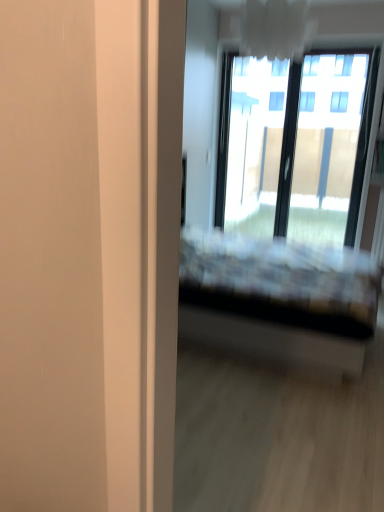
The height and width of the screenshot is (512, 384). What do you see at coordinates (278, 298) in the screenshot? I see `plaid fabric bed at center` at bounding box center [278, 298].

The image size is (384, 512). I want to click on plaid fabric bed at center, so (x=278, y=298).

The height and width of the screenshot is (512, 384). What do you see at coordinates (295, 145) in the screenshot?
I see `transparent glass window at upper right` at bounding box center [295, 145].

At what (x,y) coordinates should I click in order to perform the action: click on transparent glass window at upper right. Please return your answer as a coordinate pair (x, y). This screenshot has height=512, width=384. Looking at the image, I should click on (295, 145).

Find the location of a particular element. This screenshot has height=512, width=384. plaid fabric bed at center is located at coordinates (278, 298).

Is plaid fabric bed at center to the left of transparent glass window at upper right from the viewer's perspective?

Correct, you'll find plaid fabric bed at center to the left of transparent glass window at upper right.

Is plaid fabric bed at center further to the viewer compared to transparent glass window at upper right?

No, plaid fabric bed at center is in front of transparent glass window at upper right.

Which point is more forward, (x=284, y=250) or (x=257, y=199)?

The point (x=284, y=250) is closer.

From the image's perspective, does plaid fabric bed at center appear lower than transparent glass window at upper right?

Yes.

From a real-world perspective, between plaid fabric bed at center and transparent glass window at upper right, who is vertically lower?

plaid fabric bed at center is physically lower.

Considering the relative sizes of plaid fabric bed at center and transparent glass window at upper right in the image provided, is plaid fabric bed at center thinner than transparent glass window at upper right?

In fact, plaid fabric bed at center might be wider than transparent glass window at upper right.

Between plaid fabric bed at center and transparent glass window at upper right, which one has less height?

plaid fabric bed at center is shorter.

In terms of size, does plaid fabric bed at center appear bigger or smaller than transparent glass window at upper right?

Clearly, plaid fabric bed at center is larger in size than transparent glass window at upper right.

Is transparent glass window at upper right a part of plaid fabric bed at center?

That's incorrect, transparent glass window at upper right is not inside plaid fabric bed at center.

Is there a large distance between plaid fabric bed at center and transparent glass window at upper right?

Yes, plaid fabric bed at center is far from transparent glass window at upper right.

From the picture: Could you tell me if plaid fabric bed at center is facing transparent glass window at upper right?

No.

From the picture: What's the angular difference between plaid fabric bed at center and transparent glass window at upper right's facing directions?

plaid fabric bed at center and transparent glass window at upper right are facing 91 degrees away from each other.

The height and width of the screenshot is (512, 384). Find the location of `bed that appears in front of the transparent glass window at upper right`. bed that appears in front of the transparent glass window at upper right is located at coordinates (278, 298).

Does transparent glass window at upper right appear on the left side of plaid fabric bed at center?

In fact, transparent glass window at upper right is to the right of plaid fabric bed at center.

Is transparent glass window at upper right in front of or behind plaid fabric bed at center in the image?

transparent glass window at upper right is behind plaid fabric bed at center.

Which point is more forward, (x=278, y=176) or (x=367, y=293)?

The point (x=367, y=293) is in front.

From the image's perspective, is transparent glass window at upper right located beneath plaid fabric bed at center?

No, from the image's perspective, transparent glass window at upper right is not below plaid fabric bed at center.

From a real-world perspective, is transparent glass window at upper right on plaid fabric bed at center?

Yes, from a real-world perspective, transparent glass window at upper right is over plaid fabric bed at center

Considering the sizes of transparent glass window at upper right and plaid fabric bed at center in the image, is transparent glass window at upper right wider or thinner than plaid fabric bed at center?

In the image, transparent glass window at upper right appears to be more narrow than plaid fabric bed at center.

Is transparent glass window at upper right taller than plaid fabric bed at center?

Indeed, transparent glass window at upper right has a greater height compared to plaid fabric bed at center.

Considering the sizes of objects transparent glass window at upper right and plaid fabric bed at center in the image provided, who is smaller, transparent glass window at upper right or plaid fabric bed at center?

transparent glass window at upper right.

Is plaid fabric bed at center inside transparent glass window at upper right?

No, plaid fabric bed at center is not a part of transparent glass window at upper right.

Is transparent glass window at upper right touching plaid fabric bed at center?

No, transparent glass window at upper right is not in contact with plaid fabric bed at center.

Is transparent glass window at upper right facing towards plaid fabric bed at center?

Yes, transparent glass window at upper right faces towards plaid fabric bed at center.

Measure the distance between transparent glass window at upper right and plaid fabric bed at center.

transparent glass window at upper right is 5.16 feet away from plaid fabric bed at center.

This screenshot has height=512, width=384. What are the coordinates of `bed below the transparent glass window at upper right (from a real-world perspective)` in the screenshot? It's located at (278, 298).

Where is `bed that is under the transparent glass window at upper right (from a real-world perspective)`? Image resolution: width=384 pixels, height=512 pixels. bed that is under the transparent glass window at upper right (from a real-world perspective) is located at coordinates (278, 298).

This screenshot has width=384, height=512. What are the coordinates of `bed on the left side of transparent glass window at upper right` in the screenshot? It's located at (278, 298).